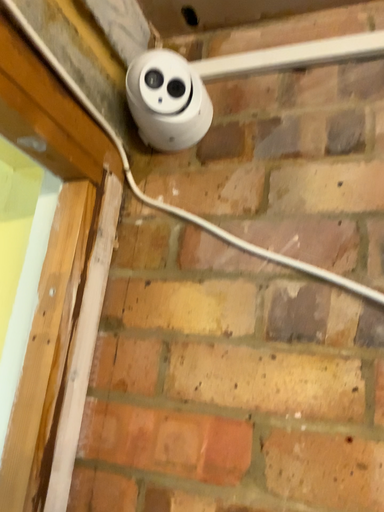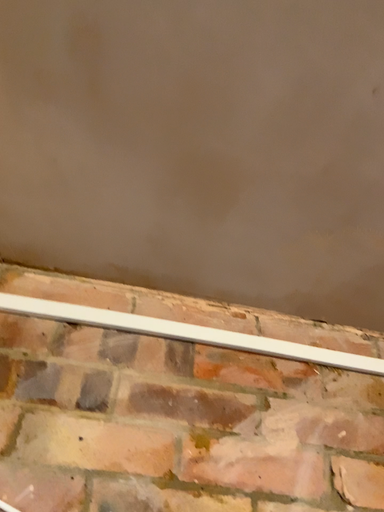
Question: How did the camera likely rotate when shooting the video?

Choices:
 (A) rotated downward
 (B) rotated upward

Answer: (B)